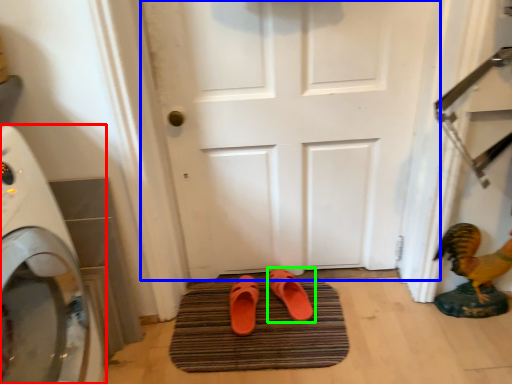
Question: Which object is the farthest from home appliance (highlighted by a red box)? Choose among these: door (highlighted by a blue box) or footwear (highlighted by a green box).

Choices:
 (A) door
 (B) footwear

Answer: (B)